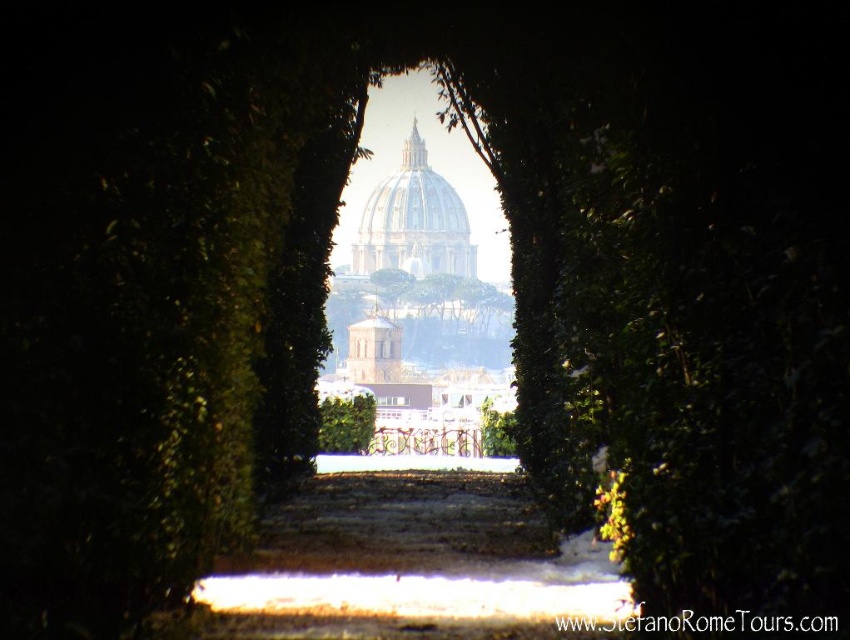
You are an architect designing a miniature model of this scene. The scale is 1 inch equals 10 feet. If the green leafy hedge at center is 2 inches wide in the model, what should be the width of the white marble dome at center?

Since the white marble dome at center is wider than the green leafy hedge at center in the actual scene, the dome should be wider than 2 inches in the model. The exact width depends on the actual dimensions, but the model must reflect the dome being larger in width compared to the hedge.

What are the coordinates of the white marble dome at center?

The white marble dome at center is located at coordinates point (412, 204).